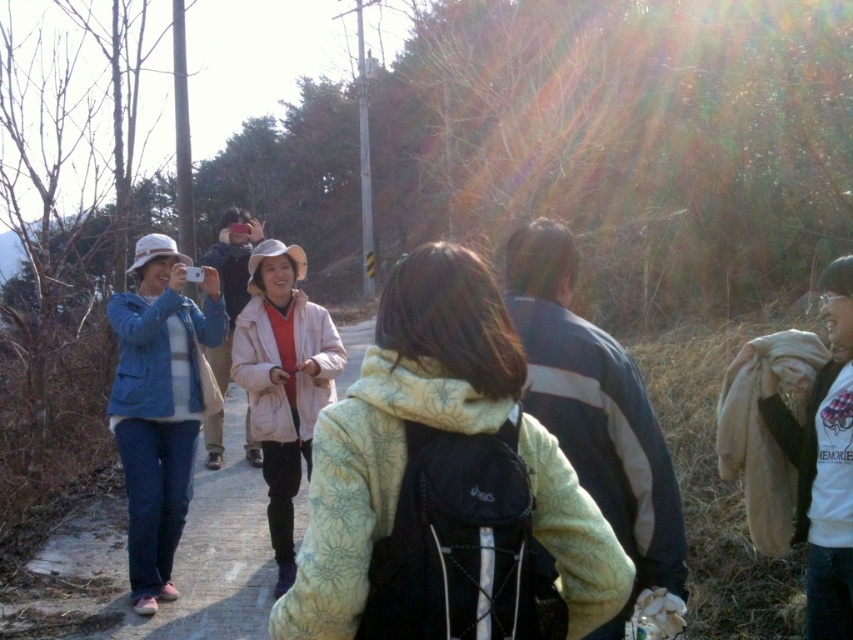
Can you confirm if blue denim jacket at left is positioned above matte blue jacket at left?

No, blue denim jacket at left is not above matte blue jacket at left.

Can you confirm if blue denim jacket at left is taller than matte blue jacket at left?

In fact, blue denim jacket at left may be shorter than matte blue jacket at left.

Is point (236, 547) positioned in front of point (151, 579)?

That is False.

At what (x,y) coordinates should I click in order to perform the action: click on blue denim jacket at left. Please return your answer as a coordinate pair (x, y). Looking at the image, I should click on 173,564.

How much distance is there between matte blue jacket at left and light pink fabric jacket at center?

62.01 centimeters

Between point (142, 512) and point (318, 333), which one is positioned in front?

Positioned in front is point (142, 512).

Is point (157, 387) behind point (254, 378)?

That is True.

Find the location of a particular element. This screenshot has height=640, width=853. matte blue jacket at left is located at coordinates (158, 404).

Does blue denim jacket at left have a larger size compared to light pink fabric jacket at center?

Correct, blue denim jacket at left is larger in size than light pink fabric jacket at center.

Is point (32, 609) closer to camera compared to point (263, 424)?

Yes, it is in front of point (263, 424).

Where is `blue denim jacket at left`? The height and width of the screenshot is (640, 853). blue denim jacket at left is located at coordinates (173, 564).